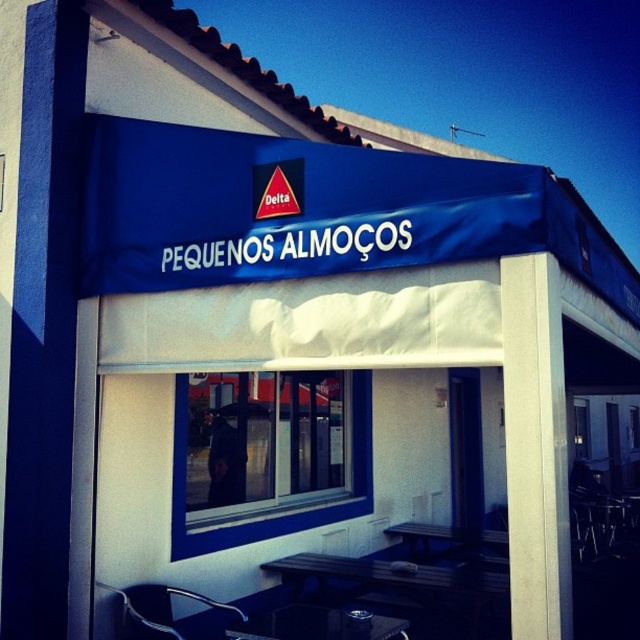
You are a customer at the Delta eatery and want to choose between the black wood table at lower center and the metallic silver table at lower center. Which table is wider?

The black wood table at lower center is wider than the metallic silver table at lower center according to the description.

You are standing outside the Delta eatery and notice two tables through the window reflection. The tables are labeled as black wood table at lower center and metallic silver table at lower center. Which table is closer to the window?

The black wood table at lower center is closer to the window because it is located below the metallic silver table at lower center, and in the reflection, lower positions typically indicate proximity to the window.

You are standing in front of the Delta eatery. You notice a point marked at coordinates (x=536, y=448) on the image. Based on the scene description, what object is located at that point?

The point at coordinates (x=536, y=448) indicates a white smooth pillar at center.